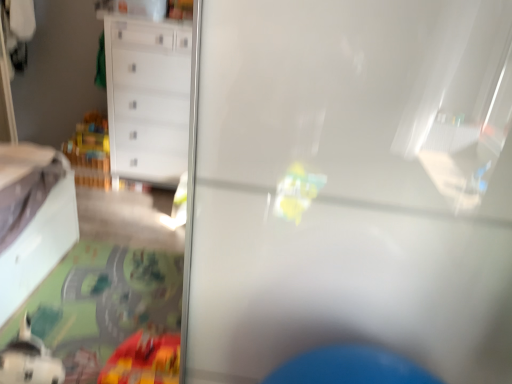
What is the approximate width of white glossy screen door at center?

69.38 centimeters.

What are the coordinates of `white glossy screen door at center` in the screenshot? It's located at (352, 184).

What do you see at coordinates (352, 184) in the screenshot? I see `white glossy screen door at center` at bounding box center [352, 184].

Locate an element on the screen. This screenshot has height=384, width=512. white glossy screen door at center is located at coordinates (352, 184).